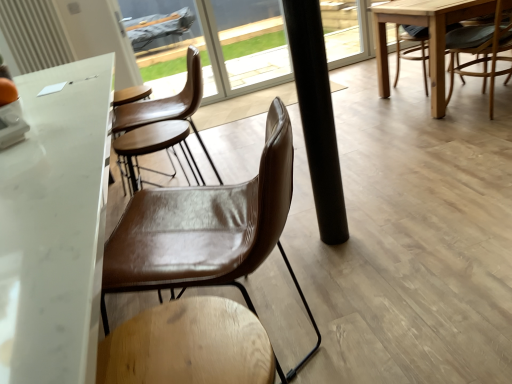
Identify the location of vacant space situated on the left part of black matte pole at center. This screenshot has width=512, height=384. (302, 241).